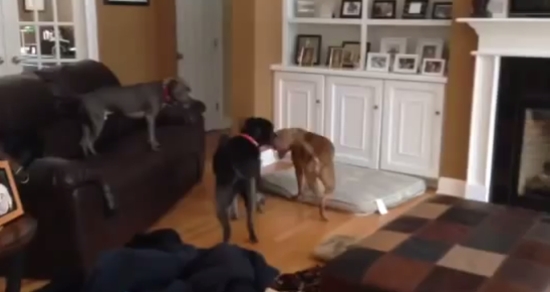
Locate an element on the screen. The width and height of the screenshot is (550, 292). dog on the couch is located at coordinates (123, 105).